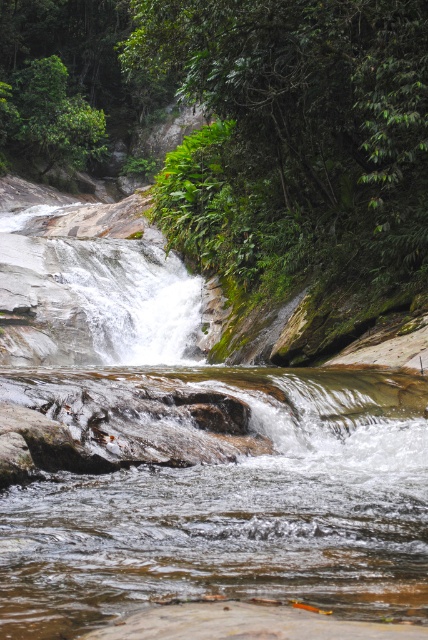
Based on the photo, you are a hiker standing at the base of the waterfall. You notice a translucent wet rock at center and a green leafy forest at upper center. Which object is closer to you?

The translucent wet rock at center is closer to you because it is in front of the green leafy forest at upper center.

You are a hiker trying to cross the stream below the waterfall. You see the translucent wet rock at center and the green leafy forest at upper center. Which object is closer to the ground?

The translucent wet rock at center is closer to the ground than the green leafy forest at upper center because it is shorter.

You are a hiker who wants to cross the stream below the waterfall. You see a translucent wet rock at center and a green leafy forest at upper center. Which object can you step on to cross the stream?

The translucent wet rock at center is thinner than the green leafy forest at upper center, so you can step on the translucent wet rock at center to cross the stream since it is a solid surface, while the forest is not a stable surface for crossing.